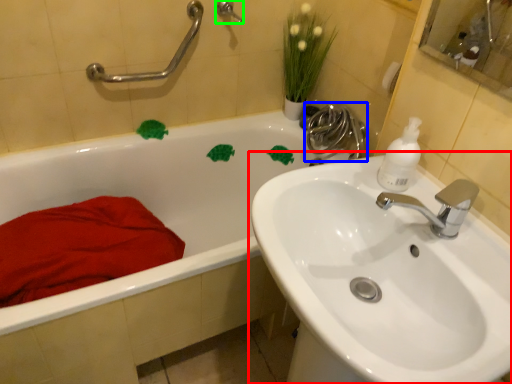
Question: Estimate the real-world distances between objects in this image. Which object is closer to sink (highlighted by a red box), plumbing fixture (highlighted by a blue box) or shower (highlighted by a green box)?

Choices:
 (A) plumbing fixture
 (B) shower

Answer: (A)